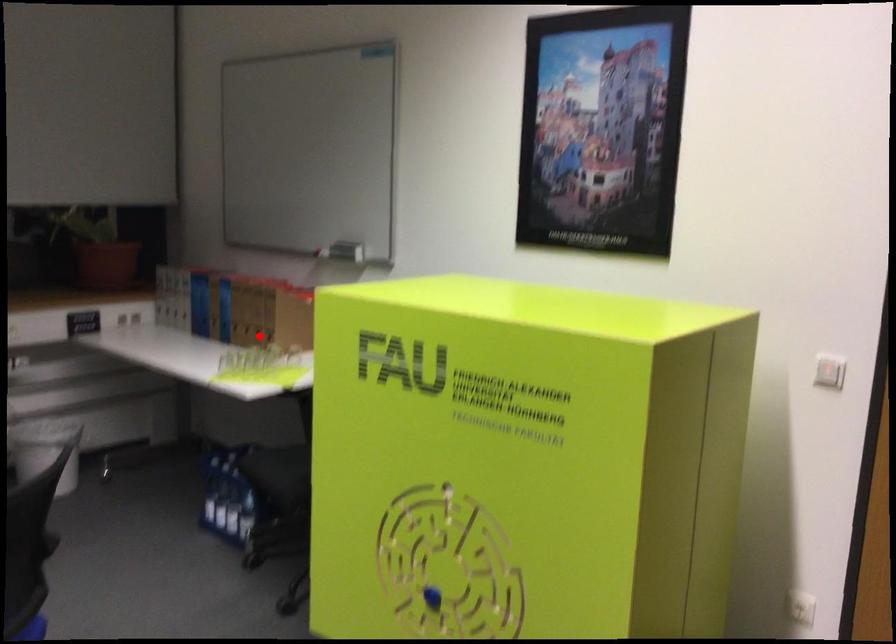
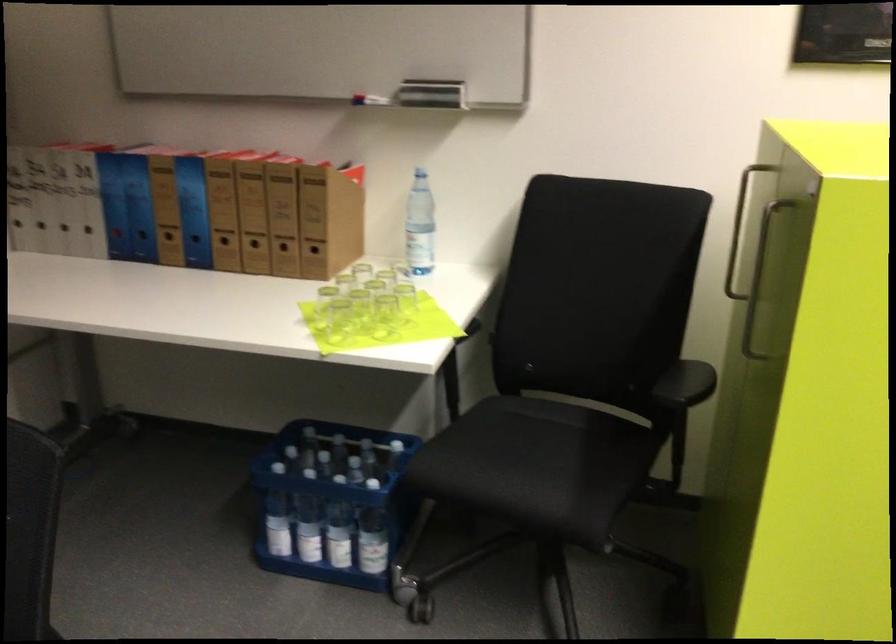
Question: I am providing you with two images of the same scene from different viewpoints. Given a red point in image1, look at the same physical point in image2. Is it:

Choices:
 (A) Closer to the viewpoint
 (B) Farther from the viewpoint

Answer: (A)